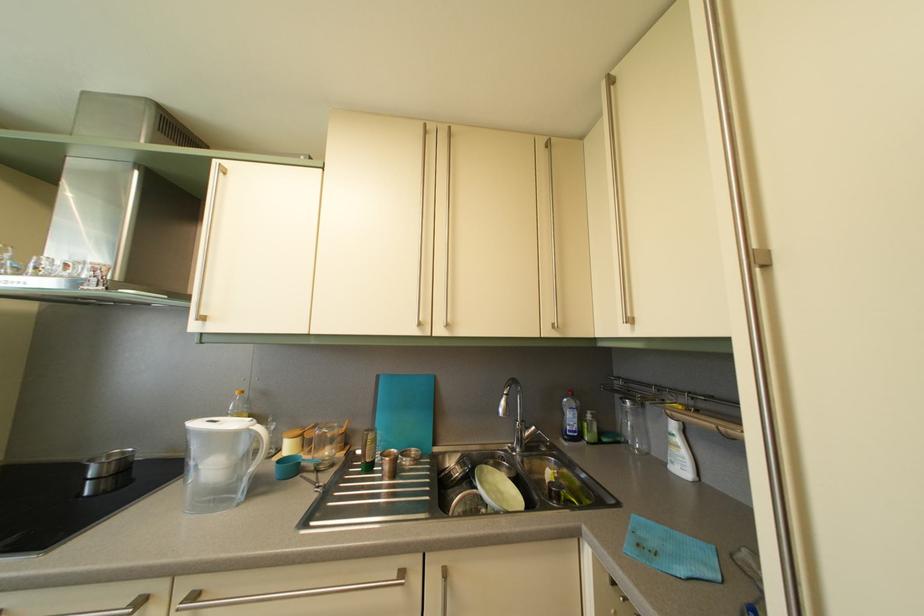
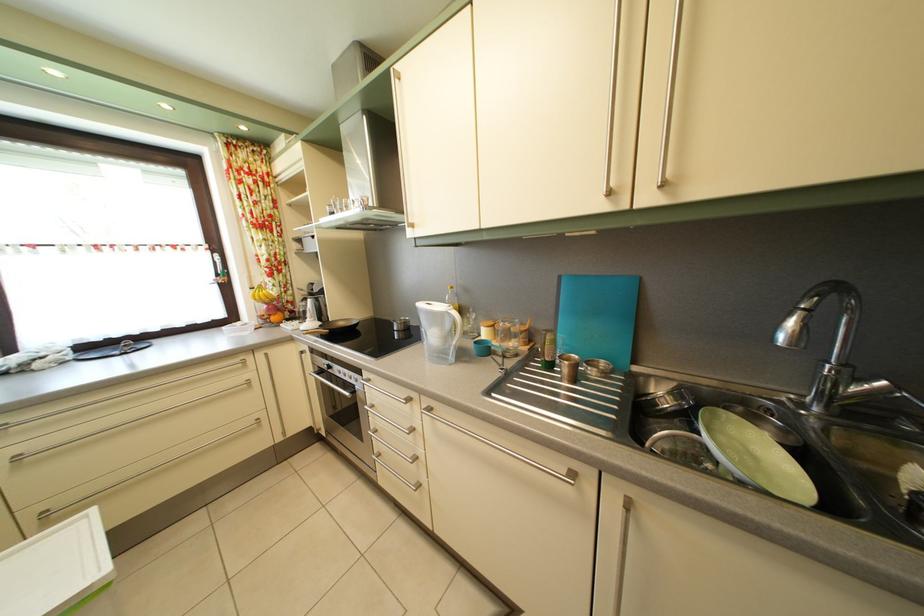
The point at [395,475] is marked in the first image. Where is the corresponding point in the second image?

(574, 378)